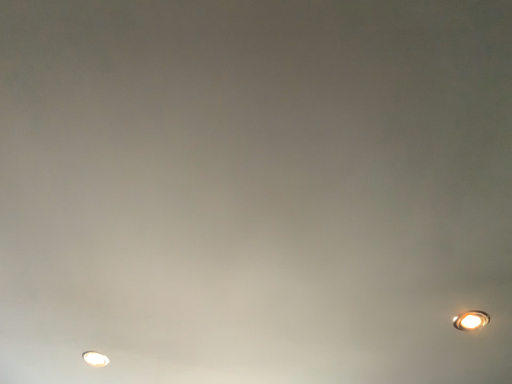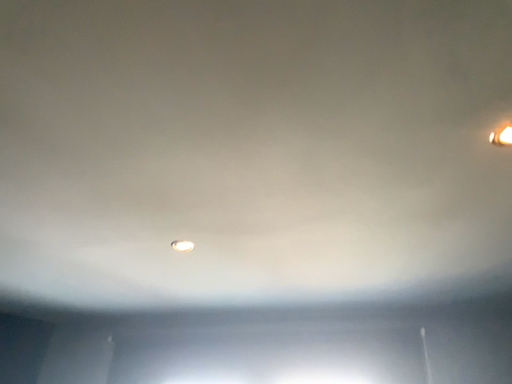
Question: Which way did the camera rotate in the video?

Choices:
 (A) rotated right
 (B) rotated left

Answer: (B)